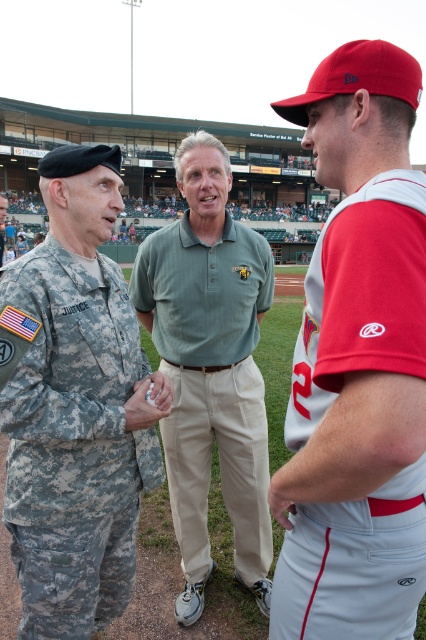
Question: Can you confirm if red fabric baseball cap at upper right is bigger than camouflage uniform at left?

Choices:
 (A) no
 (B) yes

Answer: (A)

Question: Which object appears closest to the camera in this image?

Choices:
 (A) camouflage uniform at left
 (B) green cotton polo shirt at center

Answer: (A)

Question: Is red fabric baseball cap at upper right positioned before green cotton polo shirt at center?

Choices:
 (A) yes
 (B) no

Answer: (A)

Question: Which is nearer to the red fabric baseball cap at upper right?

Choices:
 (A) green cotton polo shirt at center
 (B) camouflage uniform at left

Answer: (B)

Question: Which object is closer to the camera taking this photo?

Choices:
 (A) red fabric baseball cap at upper right
 (B) camouflage uniform at left
 (C) green cotton polo shirt at center

Answer: (A)

Question: Does red fabric baseball cap at upper right have a smaller size compared to green cotton polo shirt at center?

Choices:
 (A) yes
 (B) no

Answer: (B)